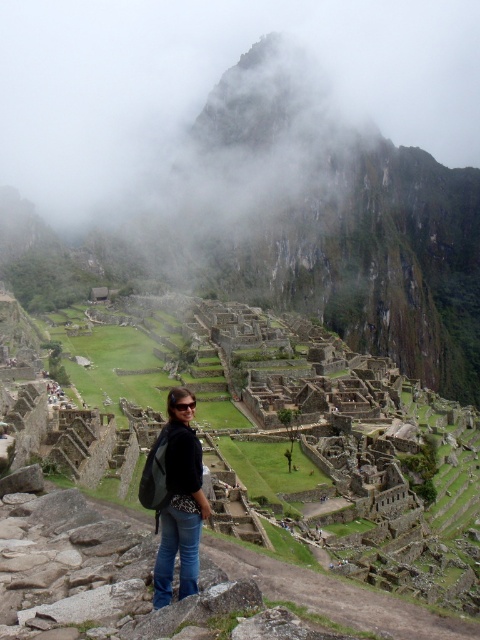
Which is above, foggy misty mountain peak at upper center or denim jeans at center?

foggy misty mountain peak at upper center is higher up.

Describe the element at coordinates (212, 81) in the screenshot. The image size is (480, 640). I see `foggy misty mountain peak at upper center` at that location.

Between point (173, 12) and point (157, 554), which one is positioned in front?

Point (157, 554)

This screenshot has height=640, width=480. In order to click on foggy misty mountain peak at upper center in this screenshot , I will do `click(212, 81)`.